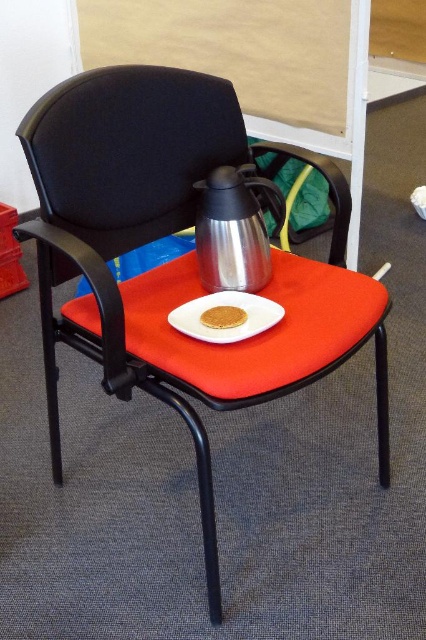
Question: Does metallic silver thermos at center have a larger size compared to golden crumbly cookie at center?

Choices:
 (A) no
 (B) yes

Answer: (B)

Question: Does metallic silver thermos at center appear on the right side of shiny metallic thermos at center?

Choices:
 (A) yes
 (B) no

Answer: (A)

Question: Which object is positioned farthest from the shiny metallic thermos at center?

Choices:
 (A) metallic silver thermos at center
 (B) golden crumbly cookie at center

Answer: (A)

Question: From the image, what is the correct spatial relationship of metallic silver thermos at center in relation to shiny metallic thermos at center?

Choices:
 (A) right
 (B) left

Answer: (A)

Question: Among these points, which one is nearest to the camera?

Choices:
 (A) (155, 340)
 (B) (276, 230)
 (C) (259, 300)

Answer: (A)

Question: Among these objects, which one is farthest from the camera?

Choices:
 (A) golden crumbly cookie at center
 (B) white matte plate at center

Answer: (A)